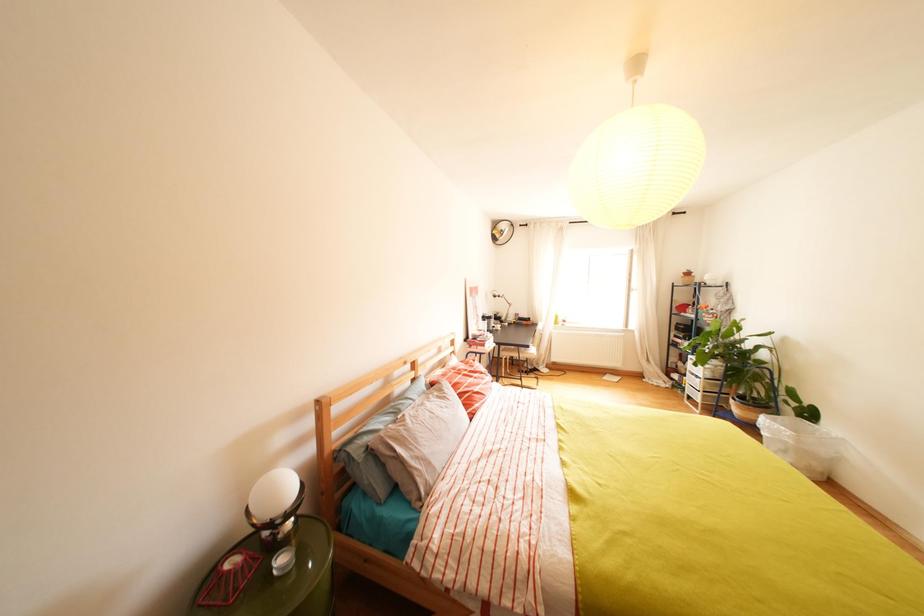
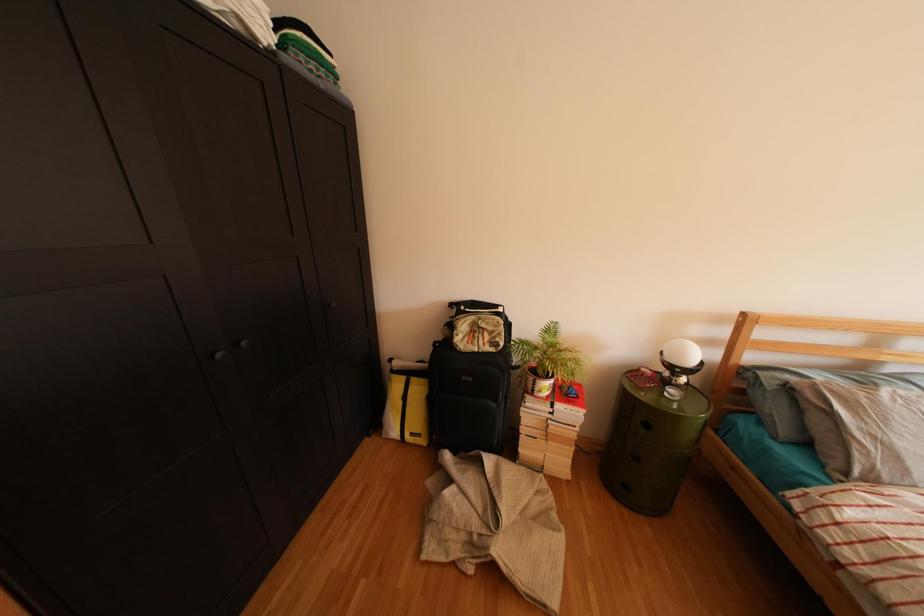
The first image is from the beginning of the video and the second image is from the end. How did the camera likely rotate when shooting the video?

The camera's rotation is toward left-down.